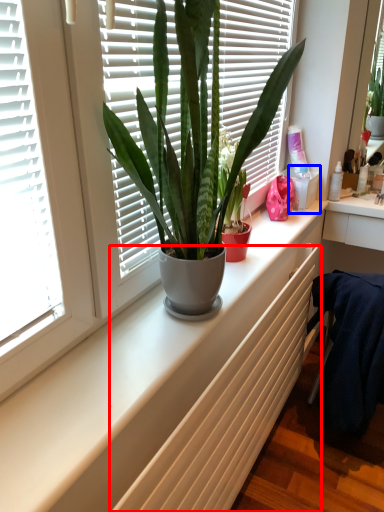
Question: Among these objects, which one is nearest to the camera, radiator (highlighted by a red box) or window box (highlighted by a blue box)?

Choices:
 (A) radiator
 (B) window box

Answer: (A)